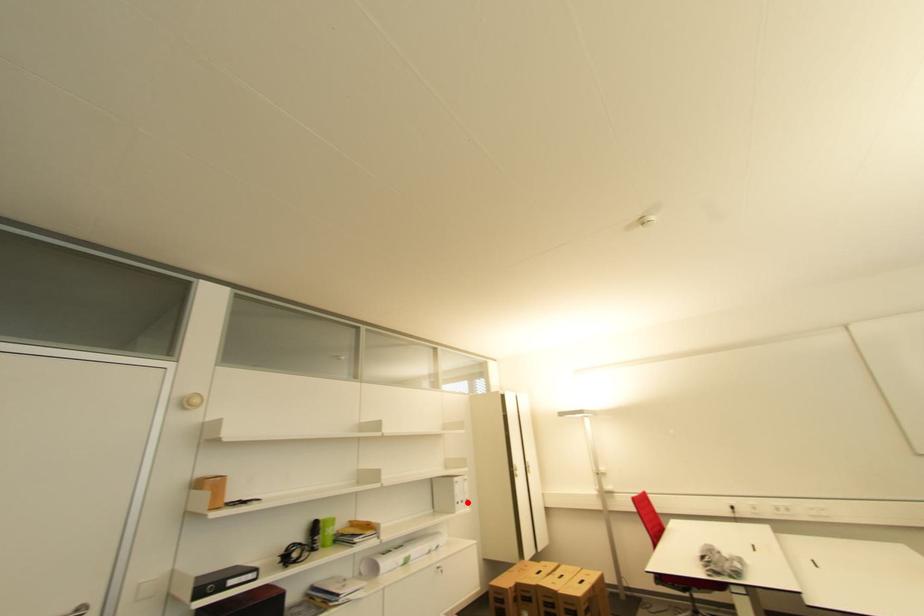
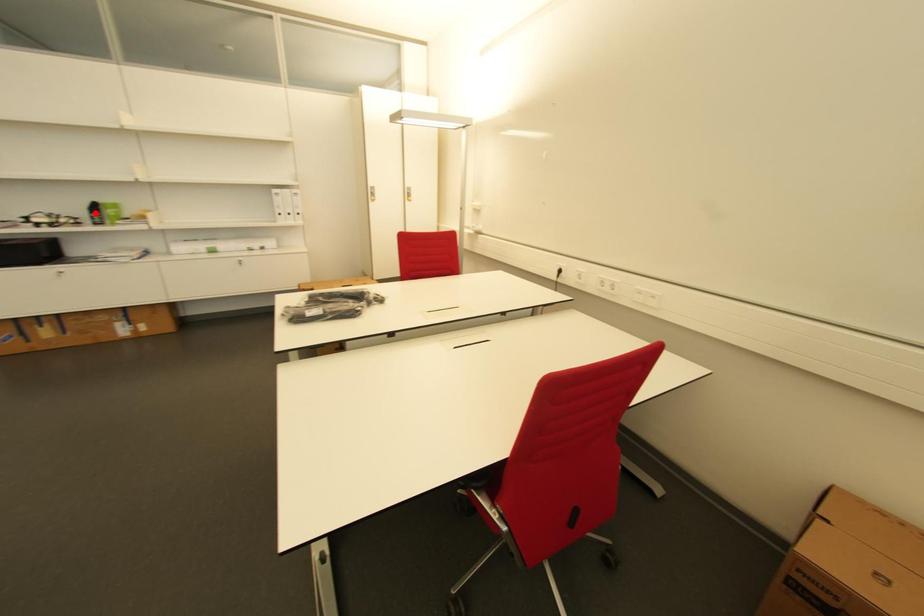
I am providing you with two images of the same scene from different viewpoints. A red point is marked on the first image and another point is marked on the second image. Is the marked point in image1 the same physical position as the marked point in image2?

No